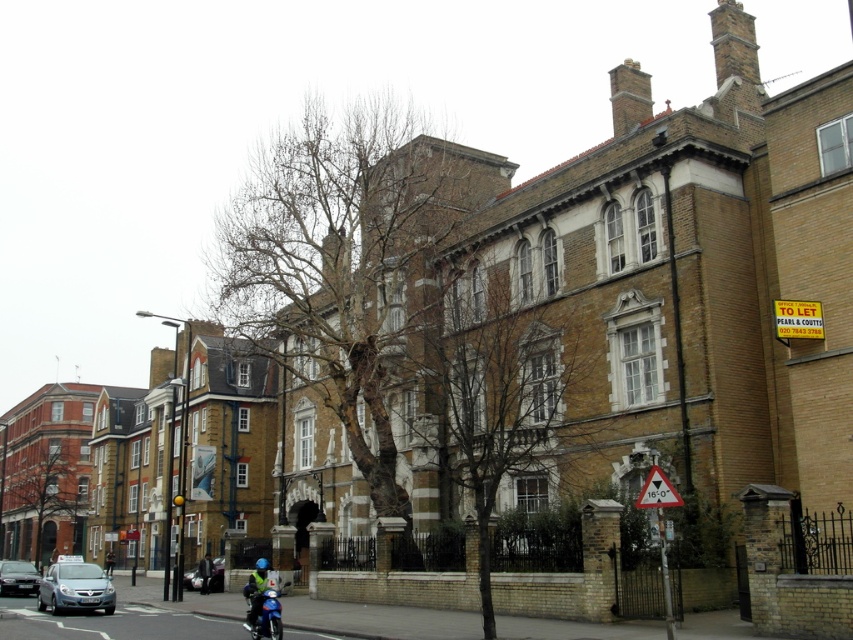
You are a delivery driver who needs to park your truck, which is 2 meters wide, in the space between the silver metallic car at lower left and the metal triangular sign at center. Can your truck fit there?

The silver metallic car at lower left might be wider than the metal triangular sign at center, so the available space between them is uncertain. Without knowing the exact width of the car, it is not possible to determine if the truck will fit.